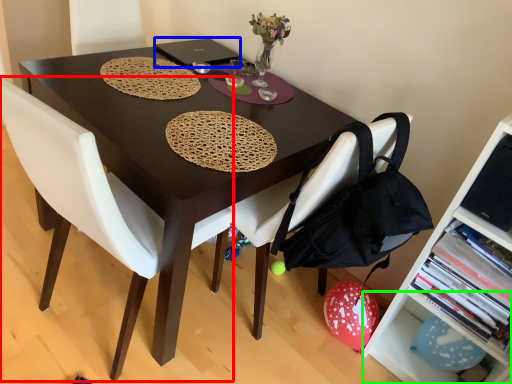
Question: Considering the real-world distances, which object is farthest from chair (highlighted by a red box)? laptop (highlighted by a blue box) or shelf (highlighted by a green box)?

Choices:
 (A) laptop
 (B) shelf

Answer: (B)